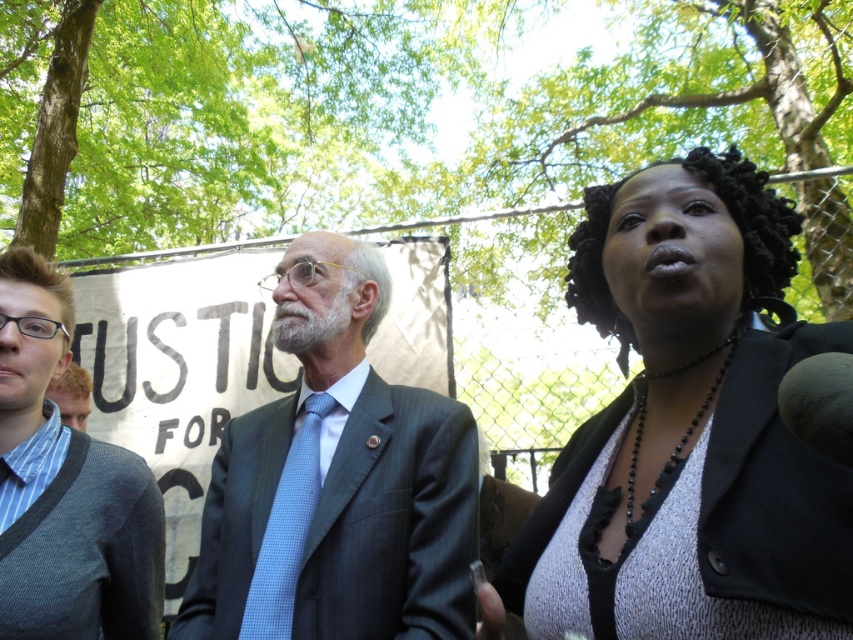
Which is above, dark gray suit at center or blonde hair at left?

dark gray suit at center is above.

What do you see at coordinates (337, 481) in the screenshot? I see `dark gray suit at center` at bounding box center [337, 481].

This screenshot has width=853, height=640. In order to click on dark gray suit at center in this screenshot , I will do `click(337, 481)`.

Which is more to the left, light blue textured tie at center or blonde hair at left?

From the viewer's perspective, blonde hair at left appears more on the left side.

Does point (292, 580) lie behind point (86, 413)?

No, (292, 580) is in front of (86, 413).

This screenshot has width=853, height=640. I want to click on light blue textured tie at center, so click(x=286, y=529).

Consider the image. How distant is black textured hair at upper right from light blue textured tie at center?

black textured hair at upper right is 26.62 inches from light blue textured tie at center.

From the picture: Does black textured hair at upper right appear on the left side of light blue textured tie at center?

In fact, black textured hair at upper right is to the right of light blue textured tie at center.

Does point (527, 572) come in front of point (293, 458)?

Yes, point (527, 572) is closer to viewer.

Locate an element on the screen. black textured hair at upper right is located at coordinates (686, 432).